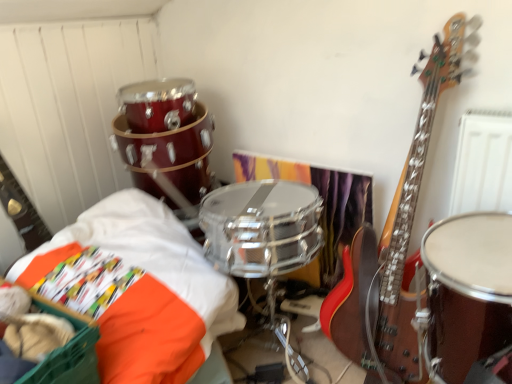
What is the approximate height of orange fabric at lower left?

17.78 inches.

Image resolution: width=512 pixels, height=384 pixels. What do you see at coordinates (67, 351) in the screenshot?
I see `orange fabric basket at lower left` at bounding box center [67, 351].

Find the location of a particular element. orange fabric at lower left is located at coordinates (137, 288).

Considering the positions of points (90, 373) and (482, 244), is point (90, 373) closer to camera compared to point (482, 244)?

Yes, it is in front of point (482, 244).

How distant is orange fabric basket at lower left from shiny brown drum at right?

34.46 inches.

From a real-world perspective, is orange fabric basket at lower left positioned over shiny brown drum at right based on gravity?

Yes, from a real-world perspective, orange fabric basket at lower left is on top of shiny brown drum at right.

Considering the sizes of objects orange fabric basket at lower left and shiny brown drum at right in the image provided, who is thinner, orange fabric basket at lower left or shiny brown drum at right?

Thinner between the two is shiny brown drum at right.

How many degrees apart are the facing directions of orange fabric at lower left and orange fabric basket at lower left?

3.03 degrees.

Which of these two, orange fabric at lower left or orange fabric basket at lower left, is smaller?

orange fabric basket at lower left.

In the scene shown: From a real-world perspective, which is physically below, orange fabric at lower left or orange fabric basket at lower left?

orange fabric at lower left, from a real-world perspective.

From the image's perspective, would you say orange fabric at lower left is shown under orange fabric basket at lower left?

Incorrect, from the image's perspective, orange fabric at lower left is higher than orange fabric basket at lower left.

From the image's perspective, between orange fabric basket at lower left and orange fabric at lower left, which one is located above?

From the image's view, orange fabric at lower left is above.

Is orange fabric basket at lower left smaller than orange fabric at lower left?

Correct, orange fabric basket at lower left occupies less space than orange fabric at lower left.

Is orange fabric basket at lower left surrounding orange fabric at lower left?

No, orange fabric at lower left is not inside orange fabric basket at lower left.

Is orange fabric basket at lower left wider or thinner than orange fabric at lower left?

Clearly, orange fabric basket at lower left has less width compared to orange fabric at lower left.

Where is `drum below the orange fabric at lower left (from a real-world perspective)`? Image resolution: width=512 pixels, height=384 pixels. drum below the orange fabric at lower left (from a real-world perspective) is located at coordinates (468, 290).

Is shiny brown drum at right facing away from orange fabric at lower left?

No, shiny brown drum at right is not facing the opposite direction of orange fabric at lower left.

Considering the sizes of objects shiny brown drum at right and orange fabric basket at lower left in the image provided, who is taller, shiny brown drum at right or orange fabric basket at lower left?

shiny brown drum at right.

Find the location of `drum on the right of orange fabric basket at lower left`. drum on the right of orange fabric basket at lower left is located at coordinates (468, 290).

Does shiny brown drum at right have a lesser width compared to orange fabric basket at lower left?

Indeed, shiny brown drum at right has a lesser width compared to orange fabric basket at lower left.

From a real-world perspective, is shiny brown drum at right beneath orange fabric basket at lower left?

Correct, in the physical world, shiny brown drum at right is lower than orange fabric basket at lower left.

From the image's perspective, is orange fabric at lower left on top of shiny brown drum at right?

Indeed, from the image's perspective, orange fabric at lower left is shown above shiny brown drum at right.

Which object is further away from the camera, orange fabric at lower left or shiny brown drum at right?

shiny brown drum at right is further away from the camera.

Where is `drum below the orange fabric at lower left (from a real-world perspective)`? drum below the orange fabric at lower left (from a real-world perspective) is located at coordinates (468, 290).

How distant is orange fabric at lower left from shiny brown drum at right?

orange fabric at lower left is 28.37 inches from shiny brown drum at right.

At what (x,y) coordinates should I click in order to perform the action: click on basket in front of the shiny brown drum at right. Please return your answer as a coordinate pair (x, y). This screenshot has height=384, width=512. Looking at the image, I should click on (67, 351).

You are a GUI agent. You are given a task and a screenshot of the screen. Output one action in this format:
    pyautogui.click(x=<x>, y=<y>)
    Task: Click on the sheet behind the orange fabric basket at lower left
    Image resolution: width=512 pixels, height=384 pixels.
    Given the screenshot: What is the action you would take?
    pyautogui.click(x=137, y=288)

Estimate the real-world distances between objects in this image. Which object is further from orange fabric basket at lower left, shiny brown drum at right or orange fabric at lower left?

Based on the image, shiny brown drum at right appears to be further to orange fabric basket at lower left.

From the picture: Estimate the real-world distances between objects in this image. Which object is closer to shiny brown drum at right, orange fabric at lower left or orange fabric basket at lower left?

orange fabric at lower left lies closer to shiny brown drum at right than the other object.

From the image, which object appears to be farther from orange fabric basket at lower left, orange fabric at lower left or shiny brown drum at right?

shiny brown drum at right is positioned further to the anchor orange fabric basket at lower left.

Which object lies further to the anchor point shiny brown drum at right, orange fabric basket at lower left or orange fabric at lower left?

Among the two, orange fabric basket at lower left is located further to shiny brown drum at right.

Considering their positions, is orange fabric basket at lower left positioned closer to orange fabric at lower left than shiny brown drum at right?

Based on the image, orange fabric basket at lower left appears to be nearer to orange fabric at lower left.

When comparing their distances from orange fabric at lower left, does shiny brown drum at right or orange fabric basket at lower left seem closer?

orange fabric basket at lower left is positioned closer to the anchor orange fabric at lower left.

Find the location of a particular element. The image size is (512, 384). sheet between orange fabric basket at lower left and shiny brown drum at right from left to right is located at coordinates (137, 288).